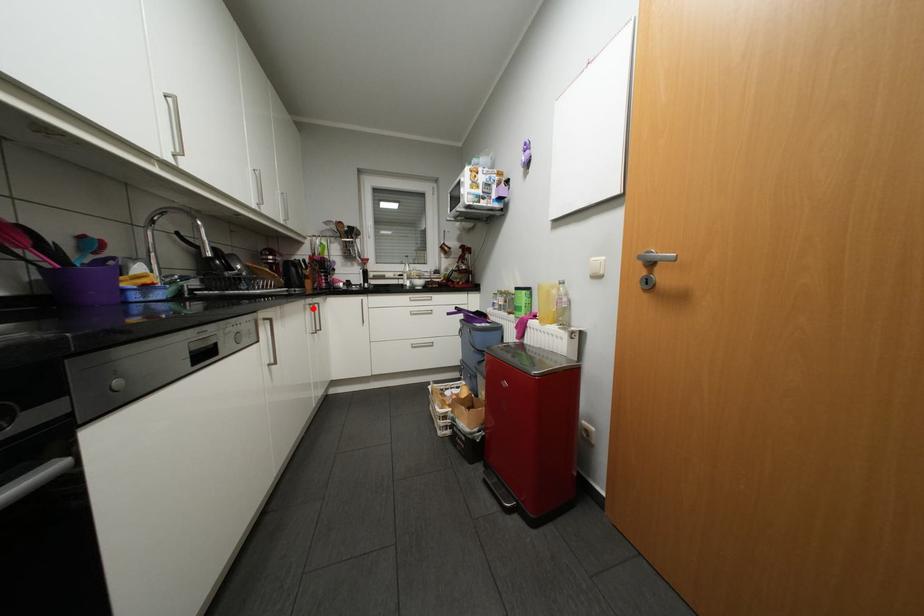
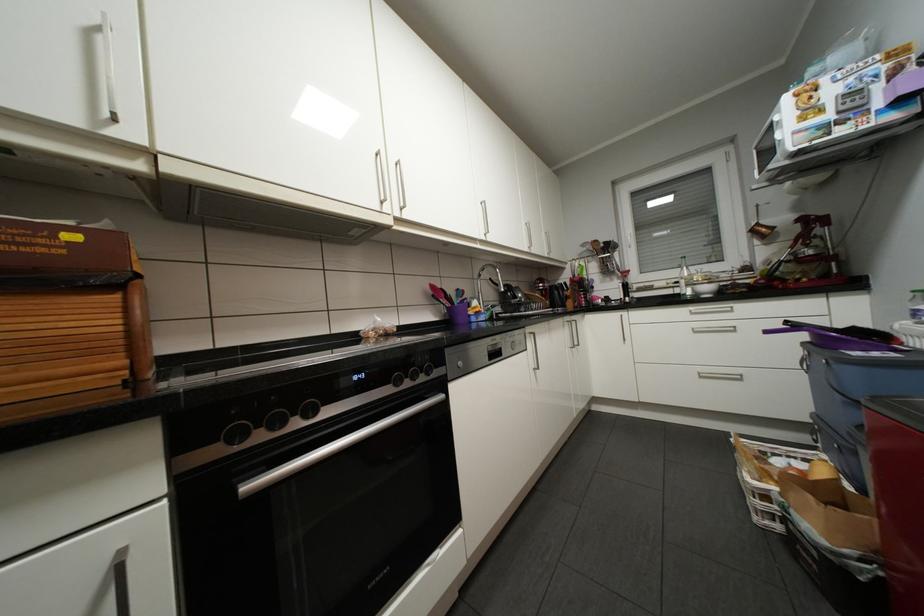
In the second image, find the point that corresponds to the highlighted location in the first image.

(572, 325)